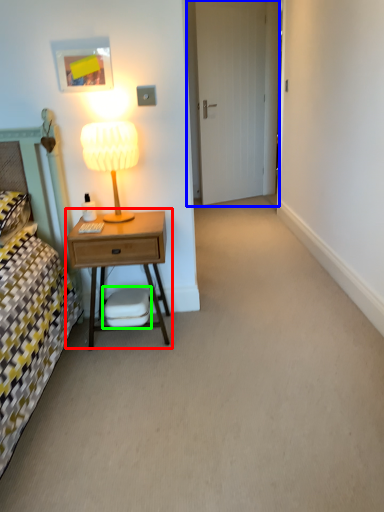
Question: Which is nearer to the nightstand (highlighted by a red box)? door (highlighted by a blue box) or swivel chair (highlighted by a green box).

Choices:
 (A) door
 (B) swivel chair

Answer: (B)